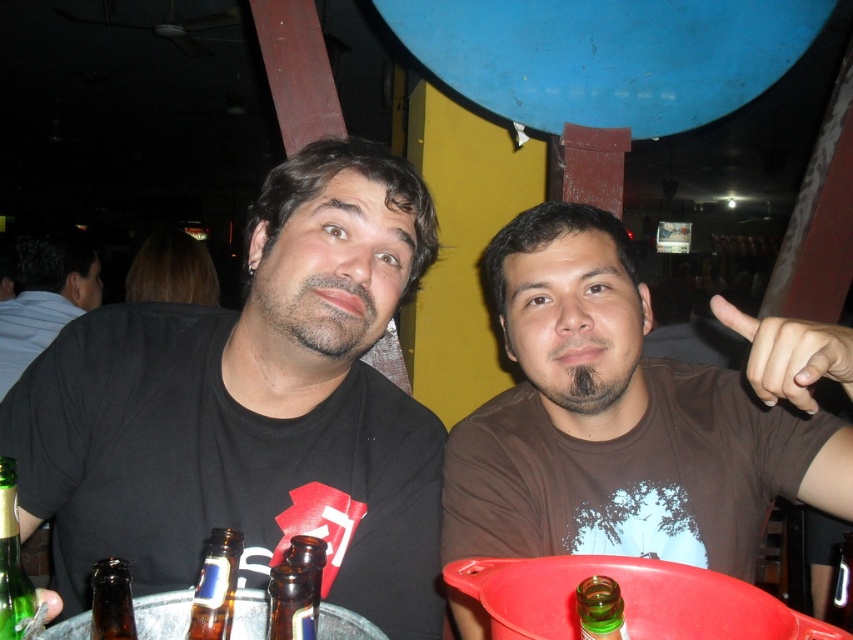
Question: Can you confirm if black matte shirt at left is bigger than black shirt at left?

Choices:
 (A) yes
 (B) no

Answer: (B)

Question: Does translucent glass beer bottle at lower left have a lesser width compared to brown glass bottle at lower left?

Choices:
 (A) yes
 (B) no

Answer: (A)

Question: Among these points, which one is nearest to the camera?

Choices:
 (A) (1, 525)
 (B) (213, 625)
 (C) (846, 349)

Answer: (B)

Question: Which point is closer to the camera?

Choices:
 (A) (816, 339)
 (B) (19, 260)
 (C) (257, 406)
 (D) (514, 298)

Answer: (A)

Question: Is black matte shirt at left to the left of green glass bottle at lower center from the viewer's perspective?

Choices:
 (A) yes
 (B) no

Answer: (A)

Question: Which object appears closest to the camera in this image?

Choices:
 (A) green glass bottle at lower left
 (B) nail polish at upper right
 (C) translucent glass bottle at lower center
 (D) brown glass bottle at lower center

Answer: (D)